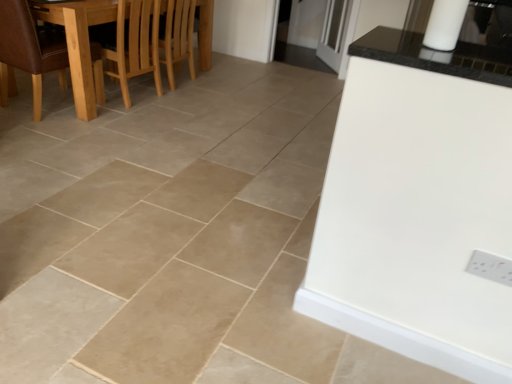
Locate an element on the screen. white plastic electric outlet at lower right is located at coordinates (490, 267).

What is the approximate width of brown leather chair at left?

It is 28.61 inches.

This screenshot has width=512, height=384. Describe the element at coordinates (78, 43) in the screenshot. I see `wooden dining table at left` at that location.

You are a GUI agent. You are given a task and a screenshot of the screen. Output one action in this format:
    pyautogui.click(x=<x>, y=<y>)
    Task: Click on the transparent glass door at upper center
    Image resolution: width=512 pixels, height=384 pixels.
    Given the screenshot: What is the action you would take?
    pyautogui.click(x=334, y=33)

This screenshot has width=512, height=384. I want to click on white plastic electric outlet at lower right, so click(490, 267).

Which is farther from the camera, (66, 63) or (185, 35)?

Positioned behind is point (185, 35).

Is brown leather chair at left bigger than light brown wooden chair at upper left?

Yes, brown leather chair at left is bigger than light brown wooden chair at upper left.

From the picture: From a real-world perspective, between brown leather chair at left and light brown wooden chair at upper left, who is vertically higher?

In real-world perspective, brown leather chair at left is above.

Does light brown wooden chair at upper left have a larger size compared to brown leather chair at left?

Actually, light brown wooden chair at upper left might be smaller than brown leather chair at left.

Does light brown wooden chair at upper left have a lesser width compared to brown leather chair at left?

Indeed, light brown wooden chair at upper left has a lesser width compared to brown leather chair at left.

Is light brown wooden chair at upper left facing towards brown leather chair at left?

No, light brown wooden chair at upper left does not turn towards brown leather chair at left.

Is transparent glass door at upper center with wooden dining table at left?

transparent glass door at upper center and wooden dining table at left are clearly separated.

Considering the positions of points (331, 45) and (87, 72), is point (331, 45) closer to camera compared to point (87, 72)?

That is False.

Measure the distance from transparent glass door at upper center to wooden dining table at left.

transparent glass door at upper center and wooden dining table at left are 2.55 meters apart from each other.

Is transparent glass door at upper center taller or shorter than wooden dining table at left?

In the image, transparent glass door at upper center appears to be taller than wooden dining table at left.

Which object is further away from the camera taking this photo, transparent glass door at upper center or white plastic electric outlet at lower right?

transparent glass door at upper center is behind.

Is transparent glass door at upper center to the left or to the right of white plastic electric outlet at lower right in the image?

Based on their positions, transparent glass door at upper center is located to the right of white plastic electric outlet at lower right.

Who is taller, transparent glass door at upper center or white plastic electric outlet at lower right?

Standing taller between the two is transparent glass door at upper center.

Is transparent glass door at upper center bigger or smaller than white plastic electric outlet at lower right?

In the image, transparent glass door at upper center appears to be larger than white plastic electric outlet at lower right.

Would you say brown leather chair at left is inside or outside transparent glass door at upper center?

brown leather chair at left lies outside transparent glass door at upper center.

Which of these two, brown leather chair at left or transparent glass door at upper center, is bigger?

brown leather chair at left is bigger.

At what (x,y) coordinates should I click in order to perform the action: click on glass door above the brown leather chair at left (from the image's perspective). Please return your answer as a coordinate pair (x, y). The height and width of the screenshot is (384, 512). Looking at the image, I should click on (334, 33).

Looking at this image, can you tell me how much wooden dining table at left and transparent glass door at upper center differ in facing direction?

The facing directions of wooden dining table at left and transparent glass door at upper center are 145 degrees apart.

Is wooden dining table at left at the right side of transparent glass door at upper center?

No.

Which is farther, (72, 36) or (345, 9)?

The point (345, 9) is more distant.

From the image's perspective, between brown leather chair at left and white plastic electric outlet at lower right, who is located below?

white plastic electric outlet at lower right.

Consider the image. Could white plastic electric outlet at lower right be considered to be inside brown leather chair at left?

No, white plastic electric outlet at lower right is not a part of brown leather chair at left.

How distant is brown leather chair at left from white plastic electric outlet at lower right?

The distance of brown leather chair at left from white plastic electric outlet at lower right is 9.29 feet.

Is brown leather chair at left oriented towards white plastic electric outlet at lower right?

No, brown leather chair at left is not oriented towards white plastic electric outlet at lower right.

This screenshot has width=512, height=384. In order to click on armchair that appears below the brown leather chair at left (from a real-world perspective) in this screenshot , I will do `click(177, 36)`.

There is a light brown wooden chair at upper left. In order to click on chair above it (from a real-world perspective) in this screenshot , I will do `click(28, 51)`.

Based on their spatial positions, is light brown wooden chair at upper left or white plastic electric outlet at lower right closer to brown leather chair at left?

light brown wooden chair at upper left is closer to brown leather chair at left.

Looking at the image, which one is located further to brown leather chair at left, transparent glass door at upper center or white plastic electric outlet at lower right?

white plastic electric outlet at lower right.

When comparing their distances from white plastic electric outlet at lower right, does transparent glass door at upper center or light brown wooden chair at upper left seem further?

The object further to white plastic electric outlet at lower right is transparent glass door at upper center.

Based on their spatial positions, is wooden dining table at left or light brown wooden chair at upper left closer to white plastic electric outlet at lower right?

The object closer to white plastic electric outlet at lower right is wooden dining table at left.

Looking at the image, which one is located closer to brown leather chair at left, light brown wooden chair at upper left or transparent glass door at upper center?

Based on the image, light brown wooden chair at upper left appears to be nearer to brown leather chair at left.

When comparing their distances from white plastic electric outlet at lower right, does wooden dining table at left or brown leather chair at left seem further?

Among the two, brown leather chair at left is located further to white plastic electric outlet at lower right.

From the image, which object appears to be nearer to light brown wooden chair at upper left, white plastic electric outlet at lower right or wooden dining table at left?

Based on the image, wooden dining table at left appears to be nearer to light brown wooden chair at upper left.

Based on their spatial positions, is light brown wooden chair at upper left or brown leather chair at left further from white plastic electric outlet at lower right?

Among the two, light brown wooden chair at upper left is located further to white plastic electric outlet at lower right.

Where is `kitchen & dining room table between white plastic electric outlet at lower right and light brown wooden chair at upper left along the z-axis`? kitchen & dining room table between white plastic electric outlet at lower right and light brown wooden chair at upper left along the z-axis is located at coordinates (78, 43).

I want to click on kitchen & dining room table between white plastic electric outlet at lower right and transparent glass door at upper center from front to back, so click(x=78, y=43).

Where is `armchair between white plastic electric outlet at lower right and transparent glass door at upper center along the z-axis`? armchair between white plastic electric outlet at lower right and transparent glass door at upper center along the z-axis is located at coordinates (177, 36).

Where is `kitchen & dining room table between brown leather chair at left and transparent glass door at upper center in the horizontal direction`? Image resolution: width=512 pixels, height=384 pixels. kitchen & dining room table between brown leather chair at left and transparent glass door at upper center in the horizontal direction is located at coordinates (78, 43).